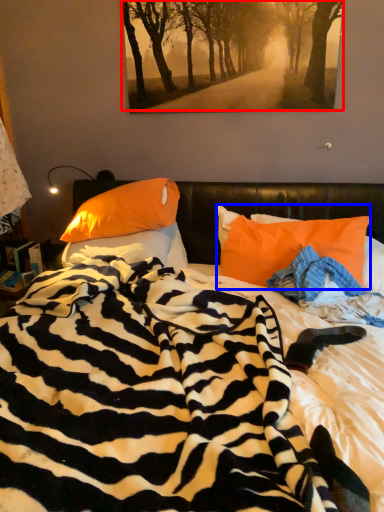
Question: Which point is further to the camera, tree (highlighted by a red box) or pillow (highlighted by a blue box)?

Choices:
 (A) tree
 (B) pillow

Answer: (A)